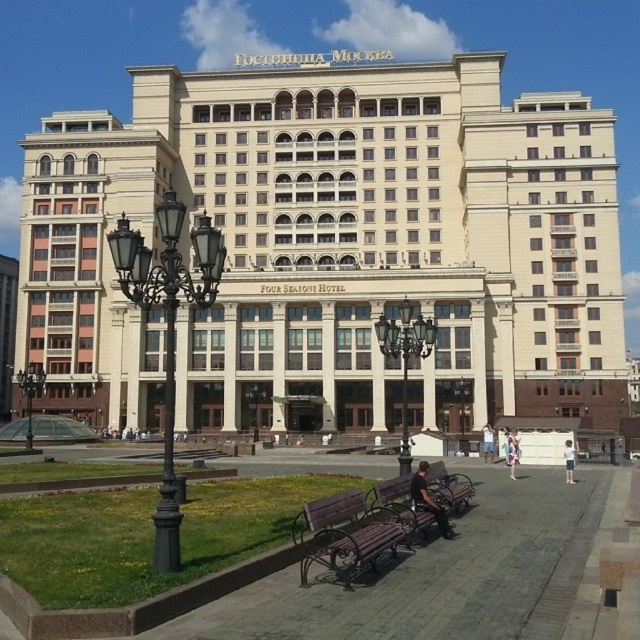
You are planning to place a 2.5 meter long sofa in front of the Hotel Moscow. You see the wooden park bench at center and the black wrought iron streetlight at lower left. Which object has enough space to accommodate the sofa without moving anything?

The black wrought iron streetlight at lower left has a width greater than the wooden park bench at center. Since the sofa is 2.5 meters long, the black wrought iron streetlight at lower left may provide sufficient space if its width meets or exceeds the sofa length. However, the wooden park bench at center is narrower and likely insufficient.

You are standing in front of the Hotel Moscow and want to take a photo of the point at coordinates point (332,531). If your camera has a maximum focus range of 35 meters, will you be able to focus on that point?

The point (332,531) is 36.75 meters from the camera, which exceeds the camera maximum focus range of 35 meters. Therefore, the camera cannot focus on the point (332,531).